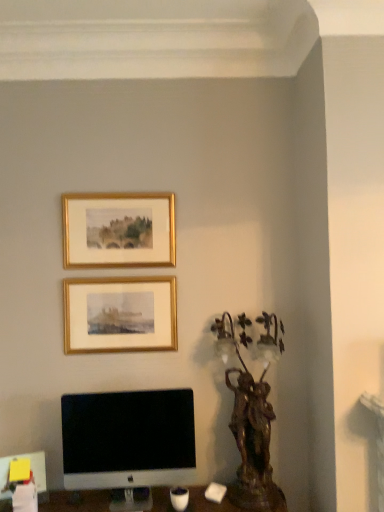
Question: From a real-world perspective, is bronze statue at right above or below gold/gilded picture frame at upper center, the 2th picture frame from the bottom?

Choices:
 (A) below
 (B) above

Answer: (A)

Question: In terms of height, does bronze statue at right look taller or shorter compared to gold/gilded picture frame at upper center, which is counted as the first picture frame, starting from the top?

Choices:
 (A) tall
 (B) short

Answer: (A)

Question: Which is farther from the gold/gilded picture frame at upper center, the 1th picture frame from the bottom?

Choices:
 (A) gold/gilded picture frame at upper center, the 2th picture frame from the bottom
 (B) bronze statue at right
 (C) white glossy computer monitor at lower left

Answer: (B)

Question: Estimate the real-world distances between objects in this image. Which object is closer to the white glossy computer monitor at lower left?

Choices:
 (A) bronze statue at right
 (B) gold/gilded picture frame at upper center, the 1th picture frame from the bottom
 (C) gold/gilded picture frame at upper center, which is counted as the first picture frame, starting from the top

Answer: (B)